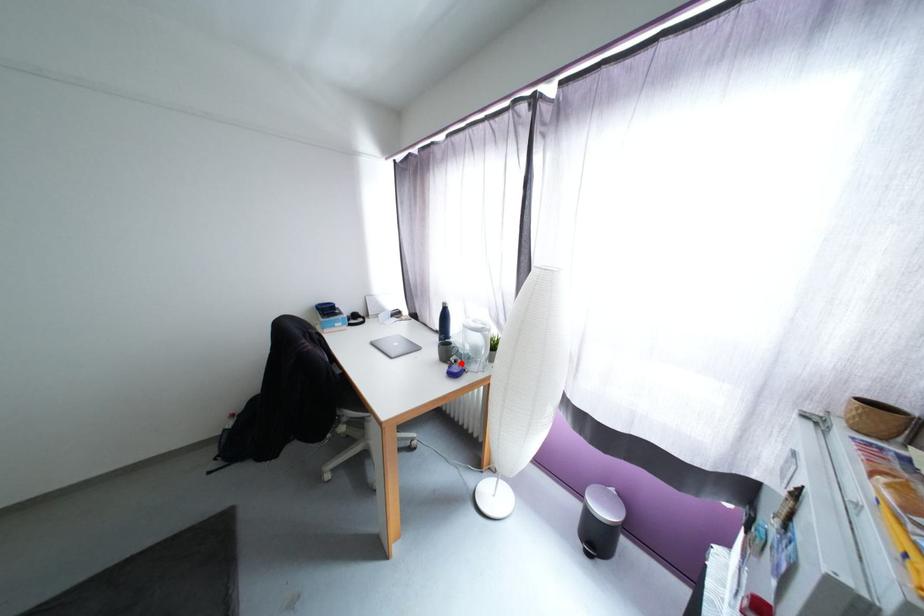
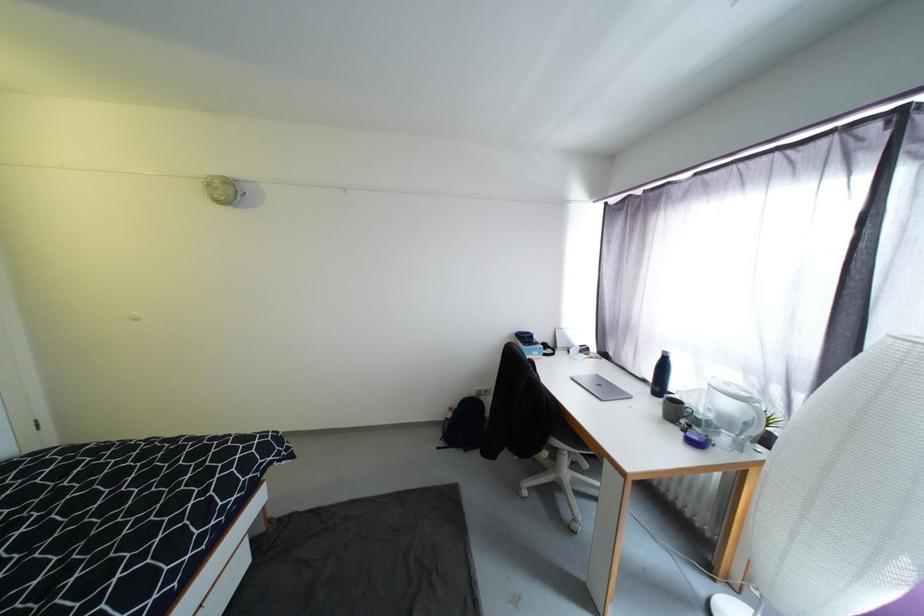
Locate, in the second image, the point that corresponds to the highlighted location in the first image.

(696, 427)